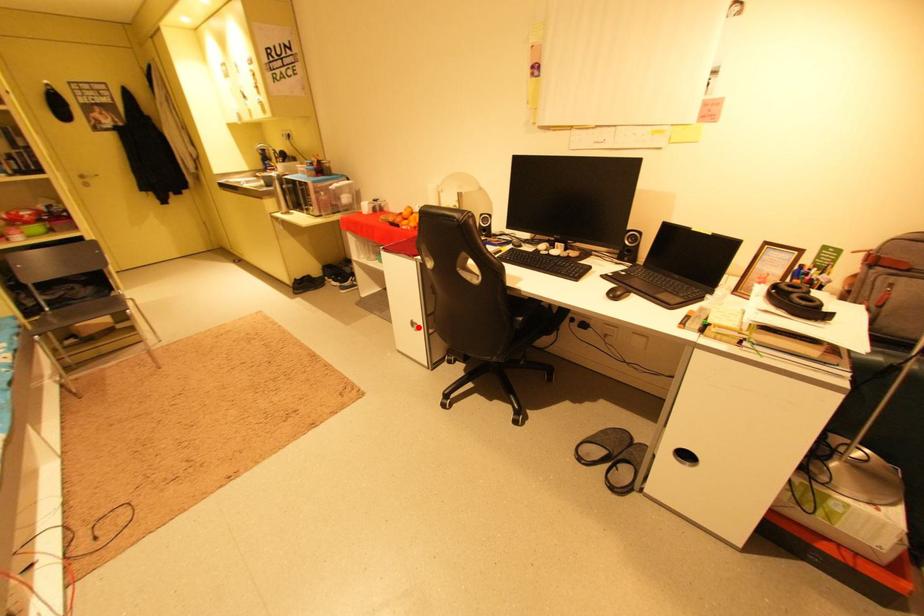
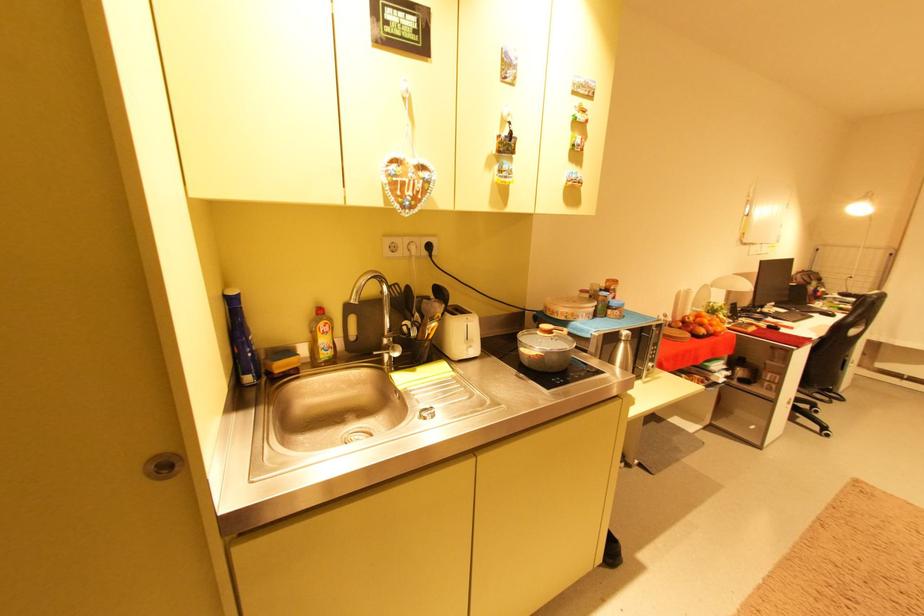
Question: I am providing you with two images of the same scene from different viewpoints. A red point is shown in image1. For the corresponding object point in image2, is it positioned nearer or farther from the camera?

Choices:
 (A) Nearer
 (B) Farther

Answer: (A)